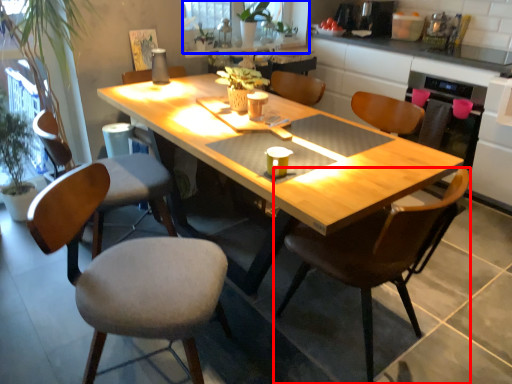
Question: Which point is further to the camera, chair (highlighted by a red box) or window screen (highlighted by a blue box)?

Choices:
 (A) chair
 (B) window screen

Answer: (B)